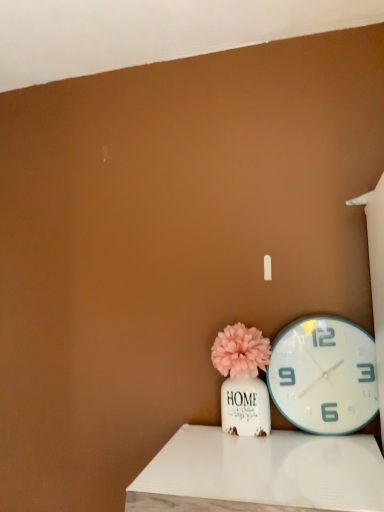
Question: From a real-world perspective, is white wood table at lower center physically below white plastic wall clock at right?

Choices:
 (A) no
 (B) yes

Answer: (B)

Question: Considering the relative sizes of white wood table at lower center and white plastic wall clock at right in the image provided, is white wood table at lower center smaller than white plastic wall clock at right?

Choices:
 (A) yes
 (B) no

Answer: (B)

Question: From the image's perspective, is white wood table at lower center on top of white plastic wall clock at right?

Choices:
 (A) yes
 (B) no

Answer: (B)

Question: Is white wood table at lower center at the right side of white plastic wall clock at right?

Choices:
 (A) no
 (B) yes

Answer: (A)

Question: Is white wood table at lower center completely or partially outside of white plastic wall clock at right?

Choices:
 (A) yes
 (B) no

Answer: (A)

Question: Considering the positions of white plastic wall clock at right and matte pink pom-pom at center in the image, is white plastic wall clock at right wider or thinner than matte pink pom-pom at center?

Choices:
 (A) wide
 (B) thin

Answer: (B)

Question: From a real-world perspective, is white plastic wall clock at right above or below matte pink pom-pom at center?

Choices:
 (A) below
 (B) above

Answer: (B)

Question: Is white plastic wall clock at right to the left or to the right of matte pink pom-pom at center in the image?

Choices:
 (A) right
 (B) left

Answer: (A)

Question: Is white plastic wall clock at right taller or shorter than matte pink pom-pom at center?

Choices:
 (A) tall
 (B) short

Answer: (A)

Question: Considering the relative positions of white plastic wall clock at right and white wood table at lower center in the image provided, is white plastic wall clock at right to the left or to the right of white wood table at lower center?

Choices:
 (A) left
 (B) right

Answer: (B)

Question: Looking at their shapes, would you say white plastic wall clock at right is wider or thinner than white wood table at lower center?

Choices:
 (A) wide
 (B) thin

Answer: (B)

Question: Looking at the image, does white plastic wall clock at right seem bigger or smaller compared to white wood table at lower center?

Choices:
 (A) big
 (B) small

Answer: (B)

Question: Would you say white plastic wall clock at right is inside or outside white wood table at lower center?

Choices:
 (A) outside
 (B) inside

Answer: (A)

Question: From the image's perspective, is white wood table at lower center positioned above or below matte pink pom-pom at center?

Choices:
 (A) above
 (B) below

Answer: (B)

Question: Is white wood table at lower center wider or thinner than matte pink pom-pom at center?

Choices:
 (A) thin
 (B) wide

Answer: (B)